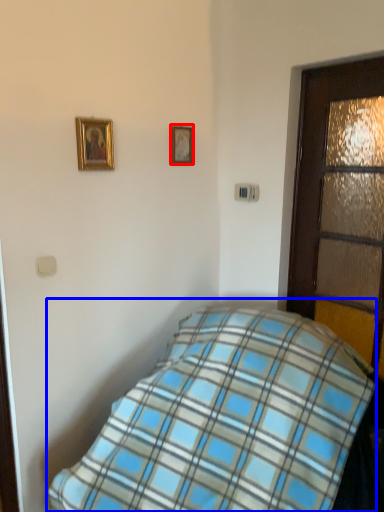
Question: Among these objects, which one is farthest to the camera, picture frame (highlighted by a red box) or bed (highlighted by a blue box)?

Choices:
 (A) picture frame
 (B) bed

Answer: (A)